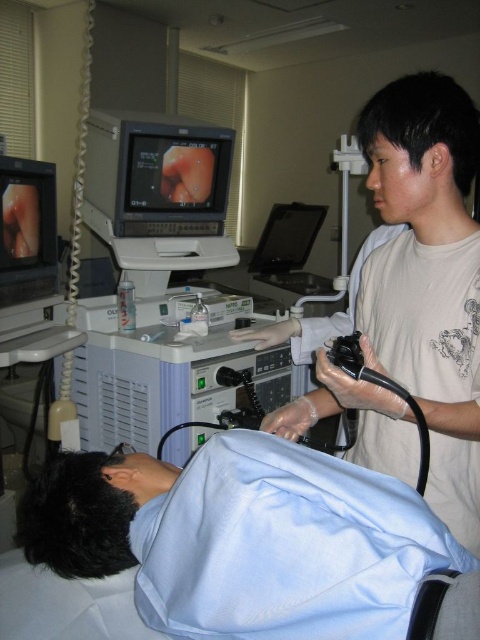
You are a medical technician who needs to adjust the monitors to ensure both are visible to the patient on the table. Given their positions, which monitor, the matte black monitor at left or the black glossy monitor at center, has a smaller screen width and might require repositioning for better visibility?

The matte black monitor at left has a lesser width compared to the black glossy monitor at center, so it might need repositioning to ensure the patient can see it properly.